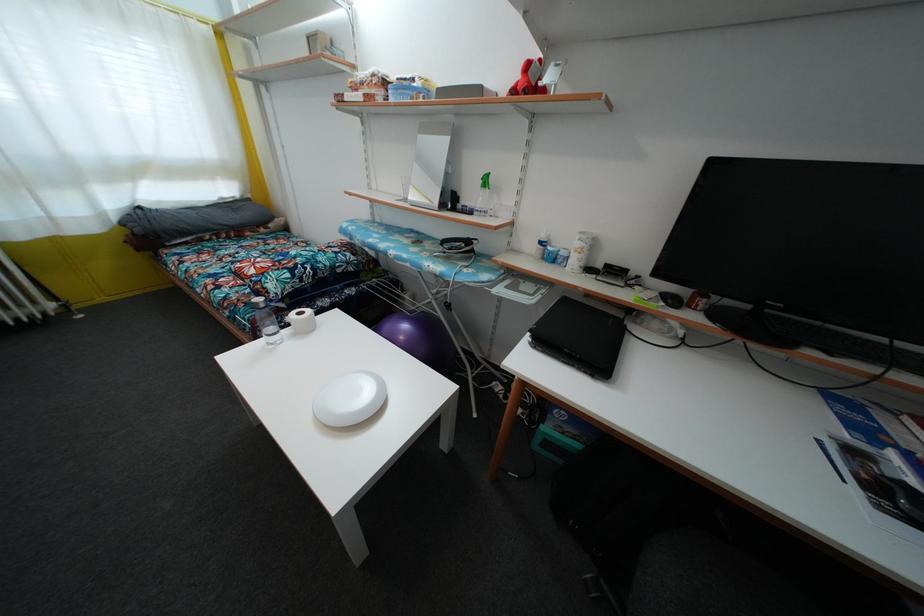
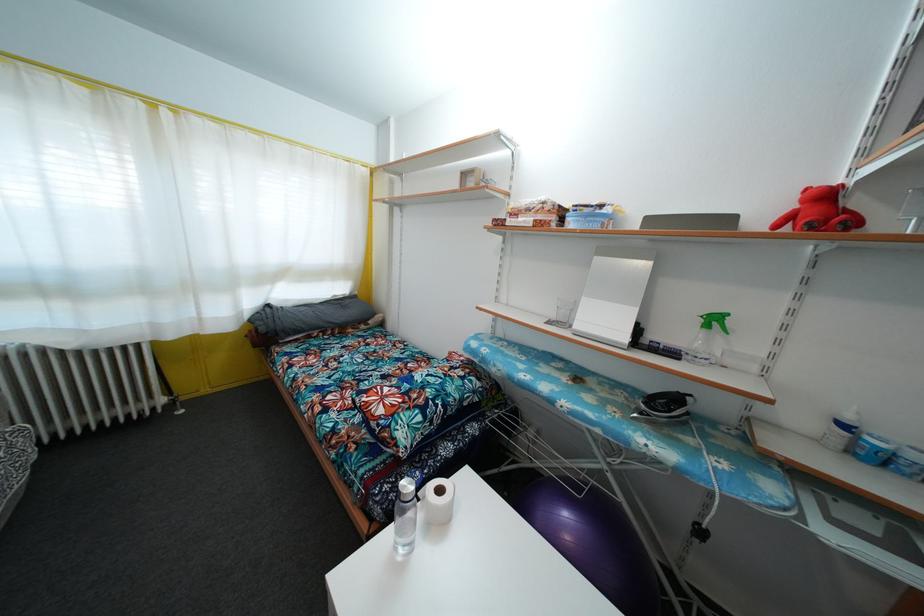
In a continuous first-person perspective shot, in which direction is the camera moving?

The cameraman walked toward left, forward.